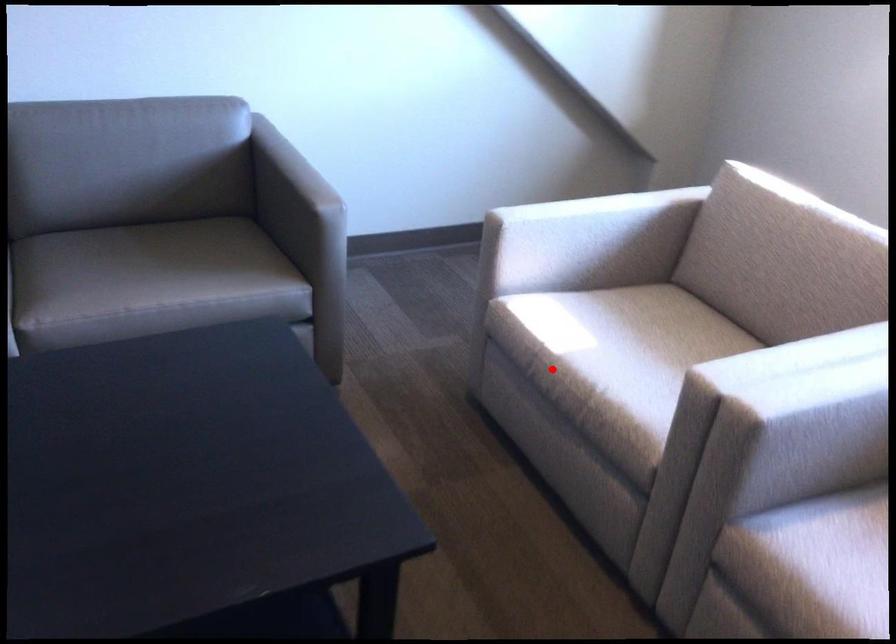
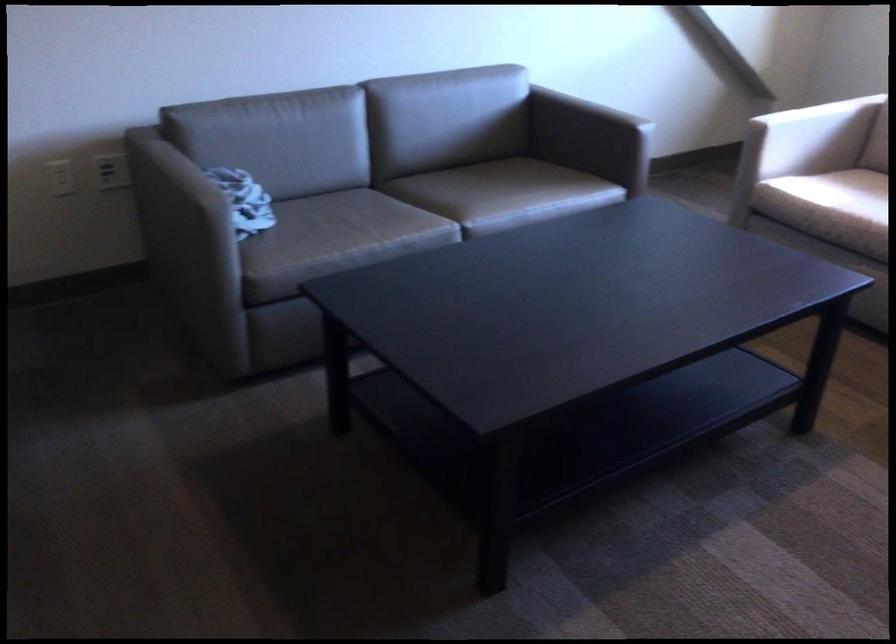
Question: I am providing you with two images of the same scene from different viewpoints. Image1 has a red point marked. In image2, the corresponding 3D location appears at what relative position? Reply with the corresponding letter.

Choices:
 (A) Closer
 (B) Farther

Answer: (B)